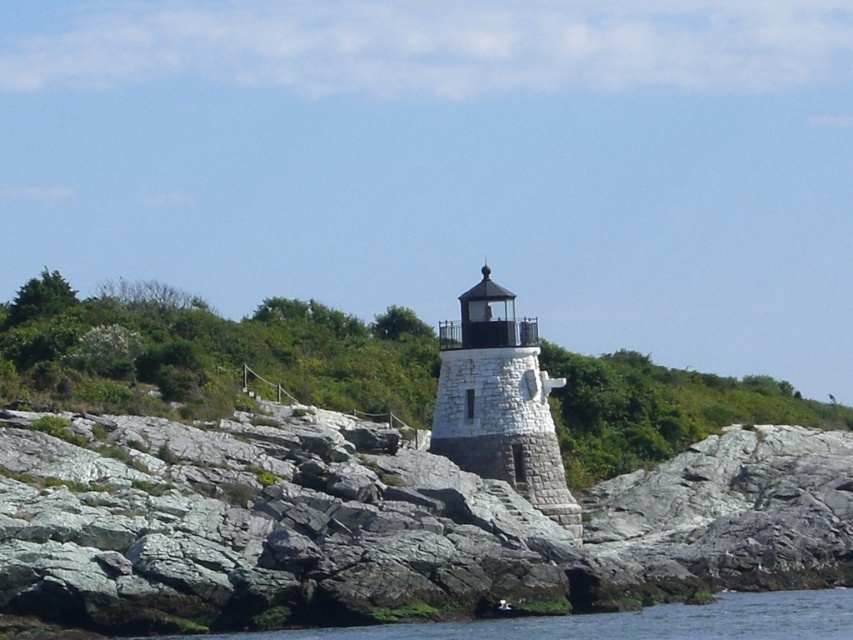
You are a painter planning to sketch the lighthouse scene. You want to ensure the gray stone at center and the white stone lighthouse at center are proportionally accurate. Which object should you draw first to maintain scale, and why?

You should draw the gray stone at center first because it is larger than the white stone lighthouse at center. Starting with the larger object helps establish the correct scale for the smaller one.

You are standing at the base of the lighthouse and want to place a small flag at each of the two points marked in the image. The first point is at coordinates point (518, 547) and the second point is at coordinates point (479, 424). Which point is closer to you so you can place the flag first?

Point (518, 547) is closer to the viewer than point (479, 424), so you should place the flag at point (518, 547) first.